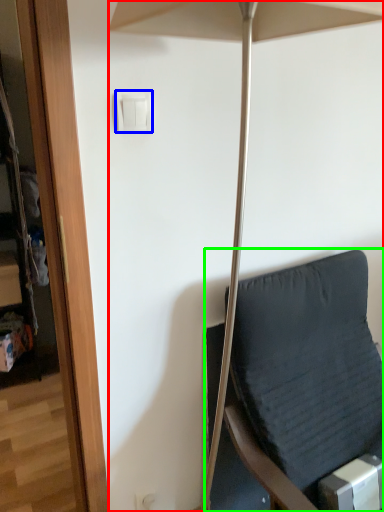
Question: Which object is the closest to the umbrella (highlighted by a red box)? Choose among these: light switch (highlighted by a blue box) or furniture (highlighted by a green box).

Choices:
 (A) light switch
 (B) furniture

Answer: (A)